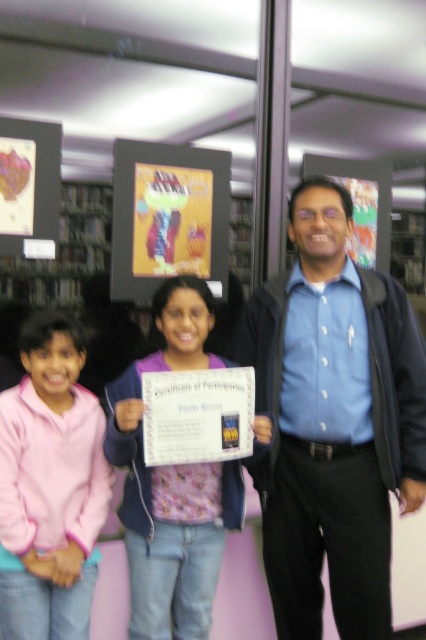
Question: Can you confirm if blue shirt at center is smaller than pink fabric shirt at center?

Choices:
 (A) no
 (B) yes

Answer: (A)

Question: Can you confirm if pink fleece jacket at lower left is thinner than pink fabric shirt at center?

Choices:
 (A) no
 (B) yes

Answer: (B)

Question: Estimate the real-world distances between objects in this image. Which object is farther from the pink fabric shirt at center?

Choices:
 (A) pink fleece jacket at lower left
 (B) blue shirt at center

Answer: (B)

Question: Which point is farther to the camera?

Choices:
 (A) pink fleece jacket at lower left
 (B) pink fabric shirt at center

Answer: (B)

Question: Which point appears farthest from the camera in this image?

Choices:
 (A) (172, 323)
 (B) (336, 332)

Answer: (B)

Question: Is blue shirt at center closer to the viewer compared to pink fleece jacket at lower left?

Choices:
 (A) yes
 (B) no

Answer: (B)